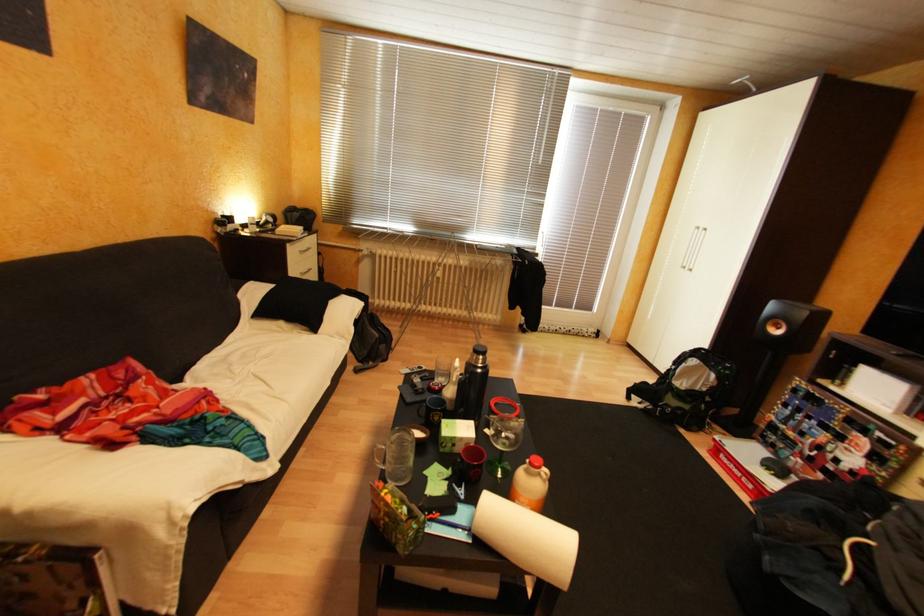
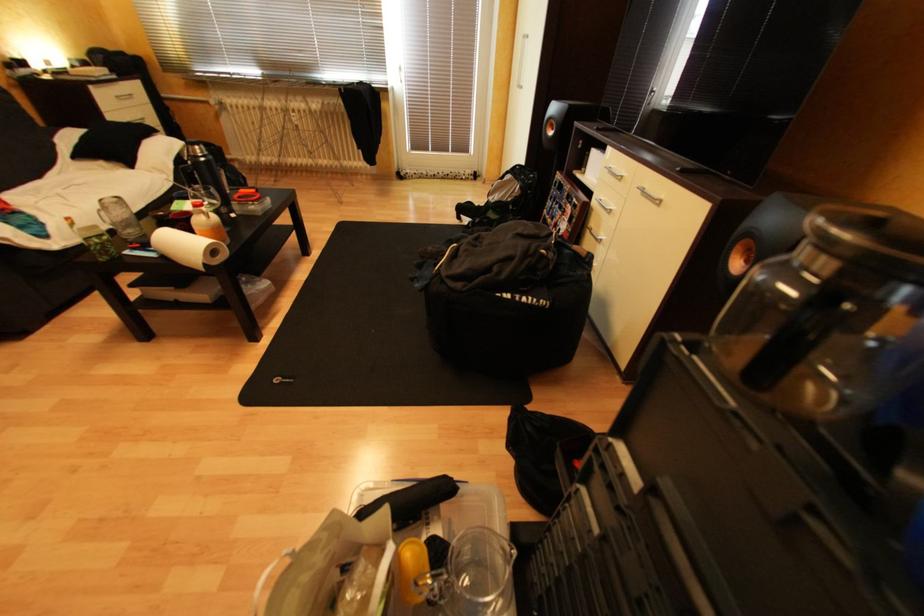
In a continuous first-person perspective shot, in which direction is the camera moving?

The movement direction of the cameraman is right, backward.